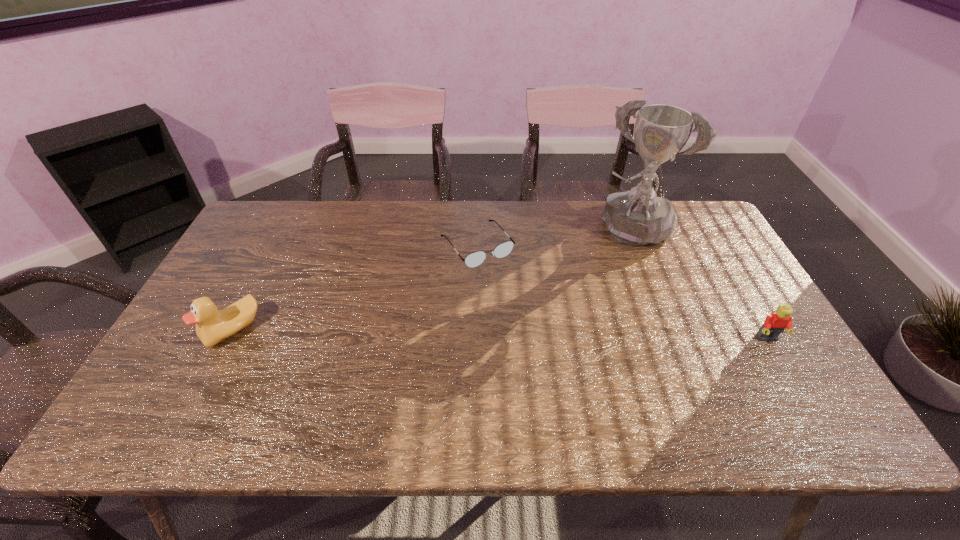
The image size is (960, 540). In order to click on vacant space in between the Lego and the duck in this screenshot , I will do `click(500, 334)`.

You are a GUI agent. You are given a task and a screenshot of the screen. Output one action in this format:
    pyautogui.click(x=<x>, y=<y>)
    Task: Click on the free space between the Lego and the shortest object
    
    Given the screenshot: What is the action you would take?
    pyautogui.click(x=622, y=292)

Locate an element on the screen. The image size is (960, 540). free space that is in between the rightmost object and the third object from right to left is located at coordinates (622, 292).

Where is `object that can be found as the third closest to the tallest object`? object that can be found as the third closest to the tallest object is located at coordinates (212, 326).

You are a GUI agent. You are given a task and a screenshot of the screen. Output one action in this format:
    pyautogui.click(x=<x>, y=<y>)
    Task: Click on the closest object to the Lego
    
    Given the screenshot: What is the action you would take?
    click(x=638, y=217)